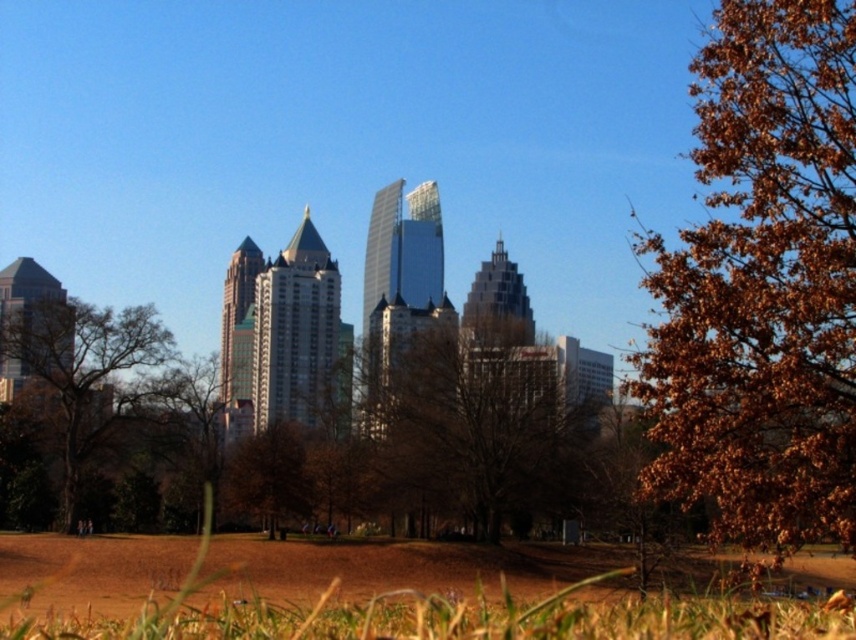
You are standing in the park and want to take a photo of the brown leafy tree at center. To avoid having the brown dry grass at lower center in the foreground, should you move to the left or right of the tree?

You should move to the right of the brown leafy tree at center because the brown dry grass at lower center is to the left of the tree, so moving right would position you away from the grass and keep it out of the photo.

You are a gardener who needs to mow the lawn. You see the brown dry grass at lower center and the brown leafy tree at center. Which object is closer to the ground?

The brown dry grass at lower center is shorter than the brown leafy tree at center, so the brown dry grass at lower center is closer to the ground.